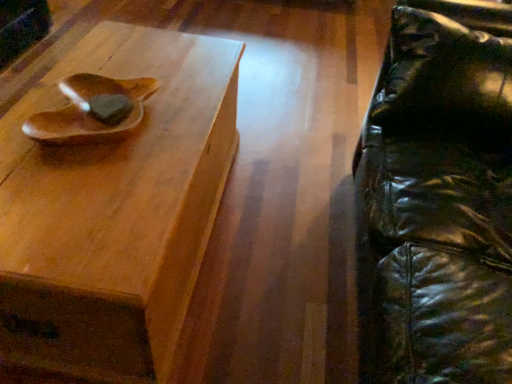
Where is `free space above wooden tray at upper left (from a real-world perspective)`? This screenshot has width=512, height=384. free space above wooden tray at upper left (from a real-world perspective) is located at coordinates (109, 133).